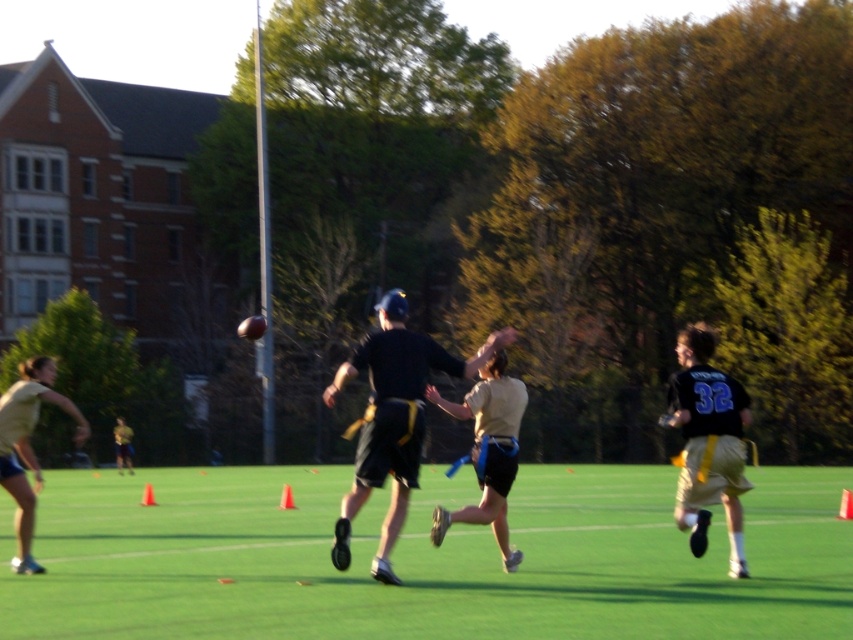
Question: Which object is closer to the camera taking this photo?

Choices:
 (A) green artificial turf at center
 (B) black jersey at right

Answer: (A)

Question: Based on their relative distances, which object is farther from the green artificial turf at center?

Choices:
 (A) black fabric shorts at center
 (B) tan fabric jersey at center
 (C) black jersey at right

Answer: (B)

Question: From the image, what is the correct spatial relationship of black fabric shorts at center in relation to black jersey at right?

Choices:
 (A) below
 (B) above

Answer: (A)

Question: Does black fabric shorts at center appear on the right side of tan fabric jersey at center?

Choices:
 (A) yes
 (B) no

Answer: (B)

Question: From the image, what is the correct spatial relationship of green artificial turf at center in relation to tan fabric jersey at center?

Choices:
 (A) above
 (B) below

Answer: (B)

Question: Which is farther from the tan fabric jersey at center?

Choices:
 (A) black fabric shorts at center
 (B) green artificial turf at center

Answer: (B)